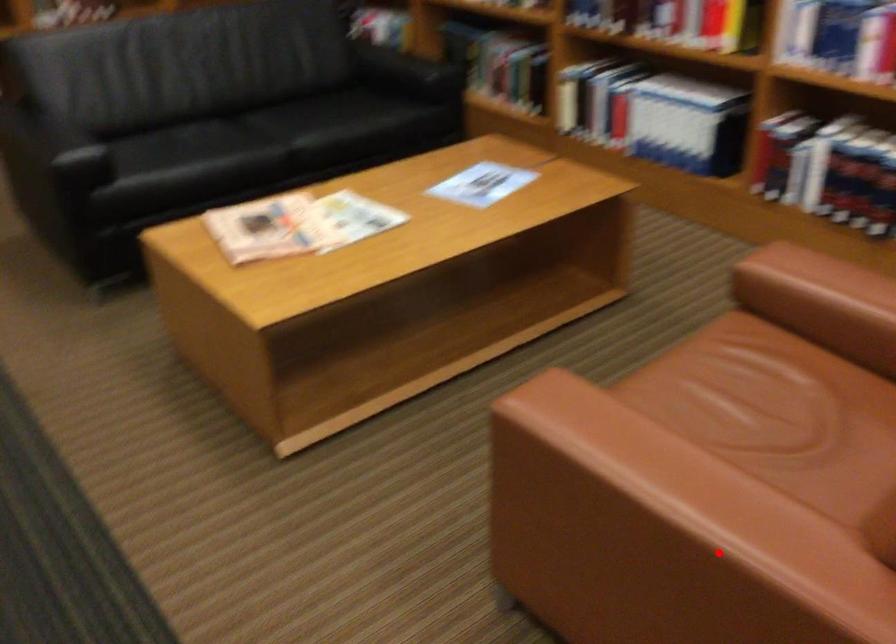
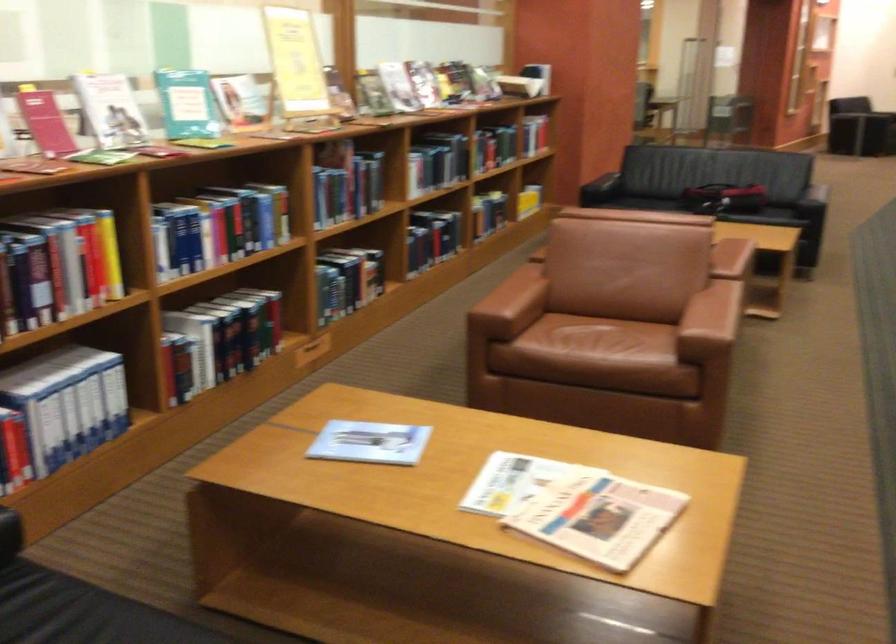
In the second image, find the point that corresponds to the highlighted location in the first image.

(719, 296)